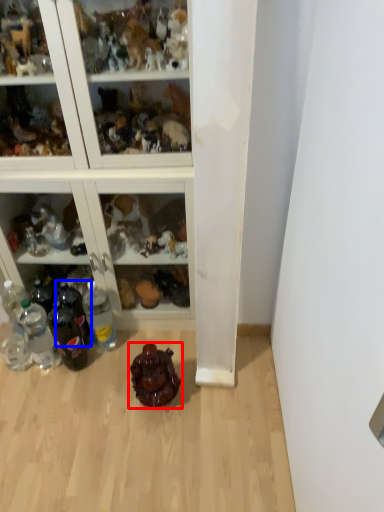
Question: Which point is closer to the camera, toy (highlighted by a red box) or bottle (highlighted by a blue box)?

Choices:
 (A) toy
 (B) bottle

Answer: (A)